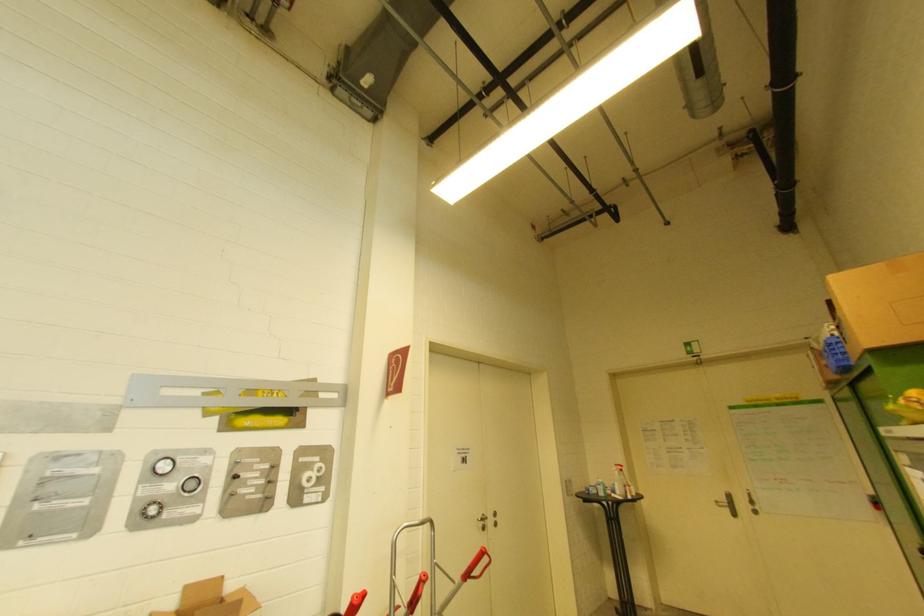
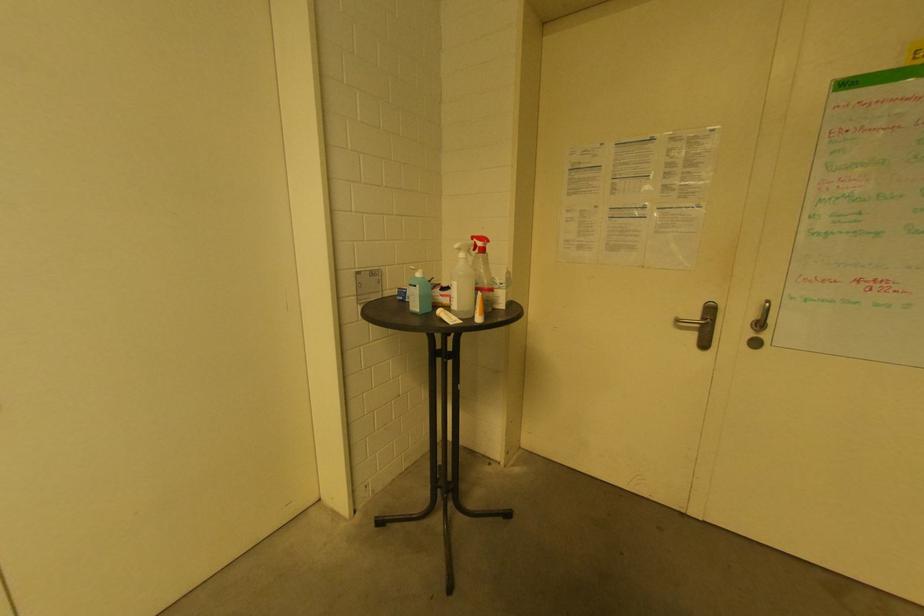
In the second image, find the point that corresponds to (x=718, y=503) in the first image.

(681, 323)